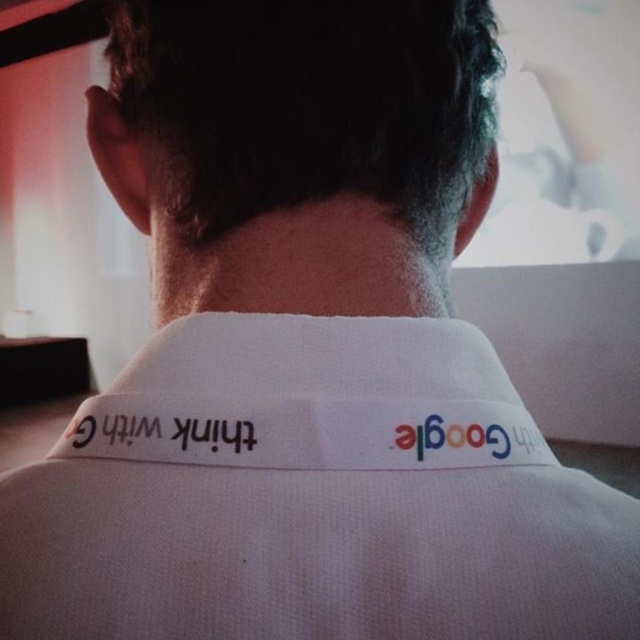
You are a photographer taking a portrait of the person in the image. The subject is facing away from you, and you need to adjust your camera to focus on the lanyard. Based on the white fabric neckband at center, where should you position your camera focus? Please provide coordinates in the format x,y where x and y are between 0 and 1.

The white fabric neckband at center is positioned at coordinates [310,397]. Therefore, you should focus your camera at [310,397] to capture the lanyard clearly.

Looking at this image, you are a photographer taking a portrait of a person wearing a lanyard. You need to ensure the white fabric neckband at center and the black fabric text at center are visible. Which object should you focus on first to make sure both are in frame?

The white fabric neckband at center is positioned on the right side of black fabric text at center. To ensure both are in frame, focus on the black fabric text at center first since it is on the left, then adjust to include the white fabric neckband at center on the right.